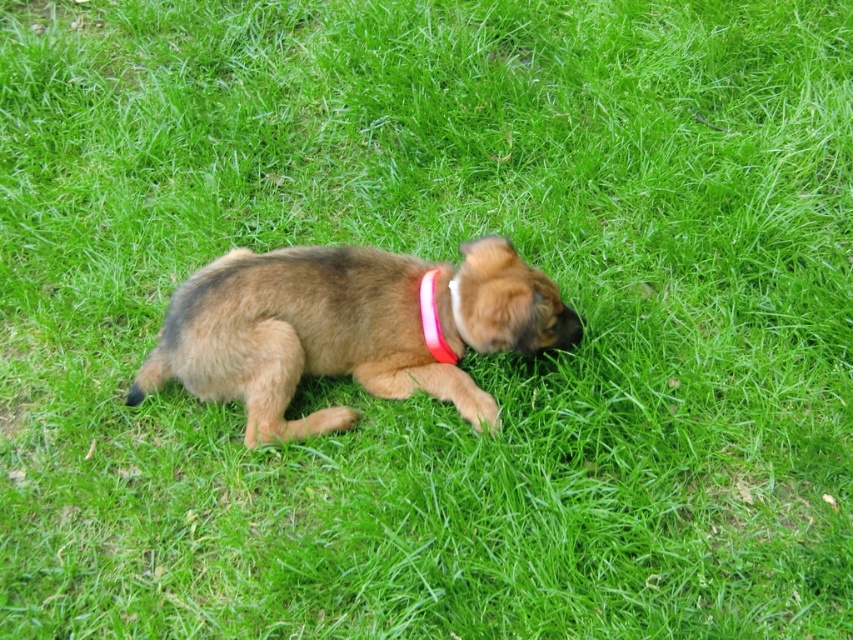
You are a photographer trying to capture the perfect shot of the brown furry dog at center. You notice a point at coordinates point (x=347, y=328). Based on the scene description, where exactly is this point located on the dog?

The point (x=347, y=328) is on the brown furry dog at center, as described in the scene.

You are a photographer who wants to capture the brown furry dog at center and its pink fabric neckband at center in a clear photo. Which one should you focus on first to ensure both are in focus?

The brown furry dog at center is below the pink fabric neckband at center. To ensure both are in focus, you should focus on the brown furry dog at center first since it is closer to the camera.